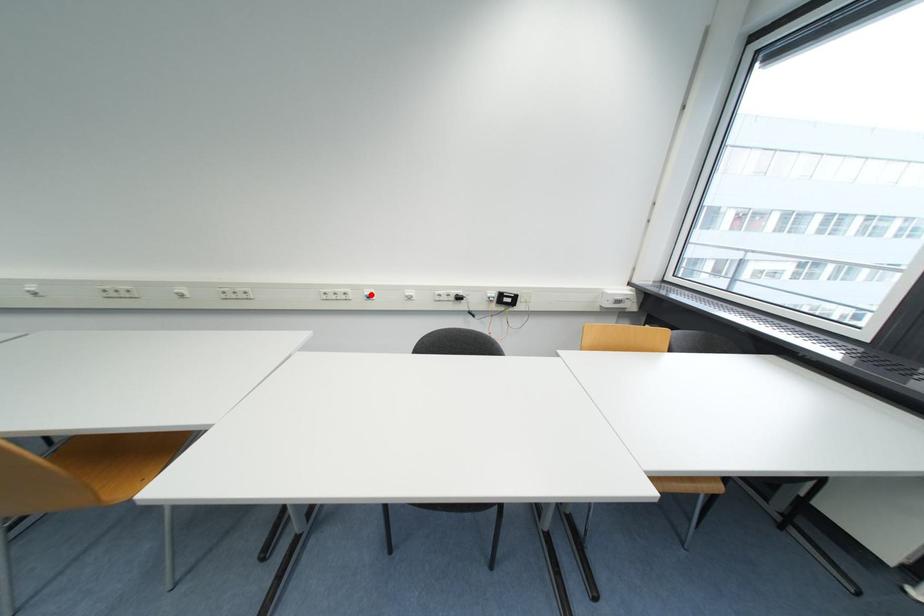
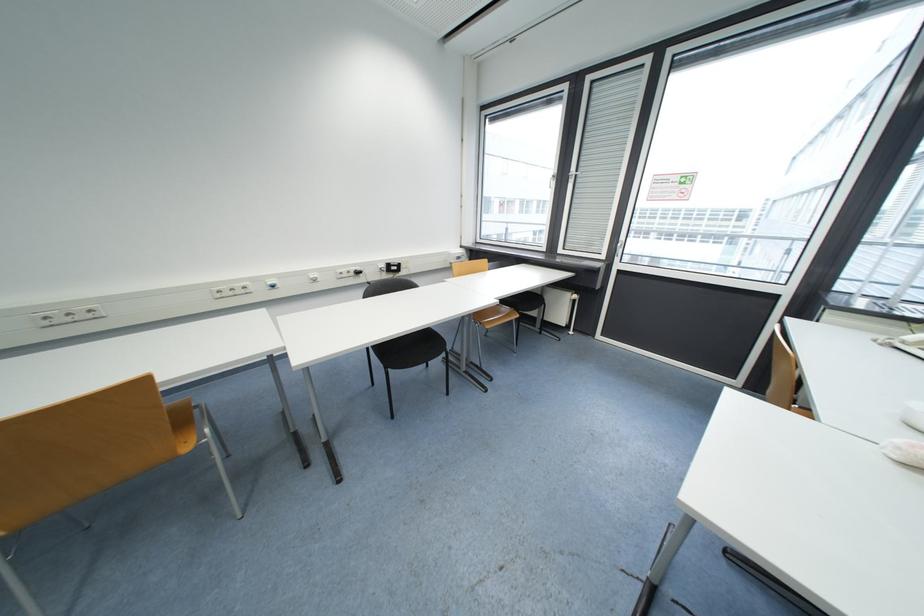
Where in the second image is the point corresponding to the highlighted location from the first image?

(274, 285)